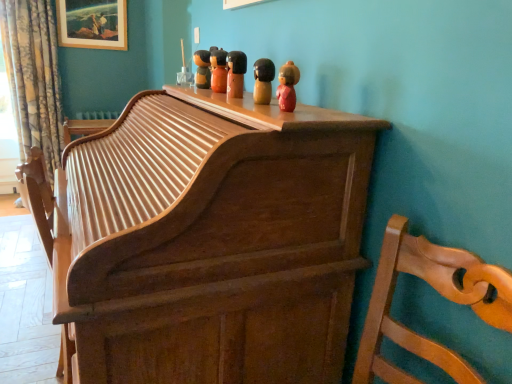
Question: Considering the relative sizes of wooden figurine at center, the 4th toy from the back, and wooden picture frame at upper left in the image provided, is wooden figurine at center, the 4th toy from the back, shorter than wooden picture frame at upper left?

Choices:
 (A) yes
 (B) no

Answer: (A)

Question: Is wooden figurine at center, the 4th toy from the back, facing away from wooden picture frame at upper left?

Choices:
 (A) yes
 (B) no

Answer: (B)

Question: Is wooden figurine at center, acting as the 2th toy starting from the right, outside wooden picture frame at upper left?

Choices:
 (A) yes
 (B) no

Answer: (A)

Question: From the image's perspective, is wooden figurine at center, acting as the 2th toy starting from the front, on wooden picture frame at upper left?

Choices:
 (A) no
 (B) yes

Answer: (A)

Question: Considering the relative sizes of wooden figurine at center, the 4th toy from the left, and wooden picture frame at upper left in the image provided, is wooden figurine at center, the 4th toy from the left, taller than wooden picture frame at upper left?

Choices:
 (A) no
 (B) yes

Answer: (A)

Question: Which is correct: wooden picture frame at upper left is inside floral fabric curtain at left, or outside of it?

Choices:
 (A) inside
 (B) outside

Answer: (B)

Question: From the image's perspective, is wooden picture frame at upper left above or below floral fabric curtain at left?

Choices:
 (A) above
 (B) below

Answer: (A)

Question: Considering the positions of wooden picture frame at upper left and floral fabric curtain at left in the image, is wooden picture frame at upper left taller or shorter than floral fabric curtain at left?

Choices:
 (A) short
 (B) tall

Answer: (A)

Question: Visually, is wooden picture frame at upper left positioned to the left or to the right of floral fabric curtain at left?

Choices:
 (A) left
 (B) right

Answer: (B)

Question: From the image's perspective, relative to wooden chair at right, is wooden doll at upper center, marked as the 1th toy in a left-to-right arrangement, above or below?

Choices:
 (A) above
 (B) below

Answer: (A)

Question: From their relative heights in the image, would you say wooden doll at upper center, marked as the 1th toy in a left-to-right arrangement, is taller or shorter than wooden chair at right?

Choices:
 (A) short
 (B) tall

Answer: (A)

Question: From a real-world perspective, is wooden doll at upper center, marked as the 1th toy in a left-to-right arrangement, physically located above or below wooden chair at right?

Choices:
 (A) below
 (B) above

Answer: (B)

Question: Considering the positions of wooden doll at upper center, marked as the 1th toy in a left-to-right arrangement, and wooden chair at right in the image, is wooden doll at upper center, marked as the 1th toy in a left-to-right arrangement, bigger or smaller than wooden chair at right?

Choices:
 (A) big
 (B) small

Answer: (B)

Question: From a real-world perspective, is wooden figurine at upper center, which is counted as the first toy, starting from the front, physically located above or below floral fabric curtain at left?

Choices:
 (A) below
 (B) above

Answer: (B)

Question: Considering the positions of point (284, 64) and point (37, 39), is point (284, 64) closer or farther from the camera than point (37, 39)?

Choices:
 (A) farther
 (B) closer

Answer: (B)